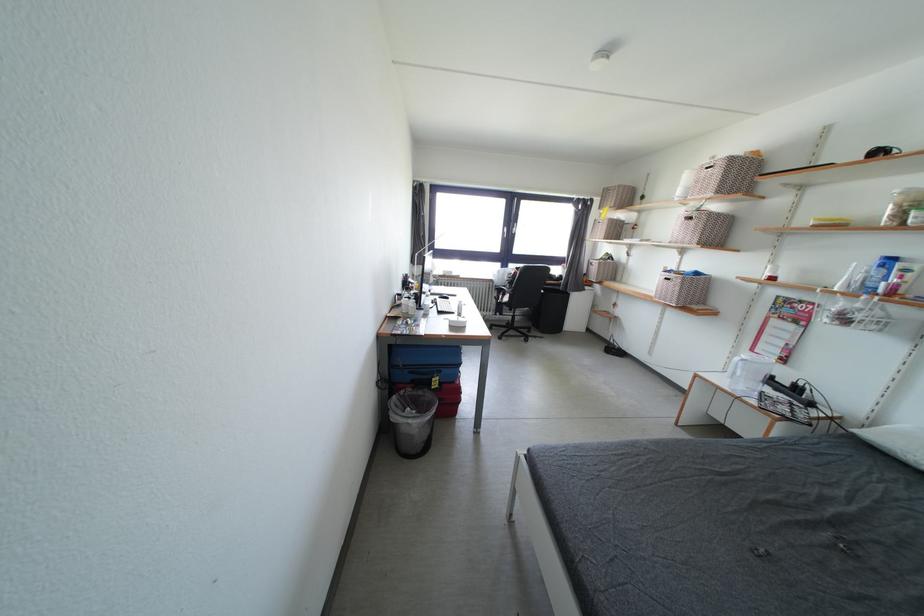
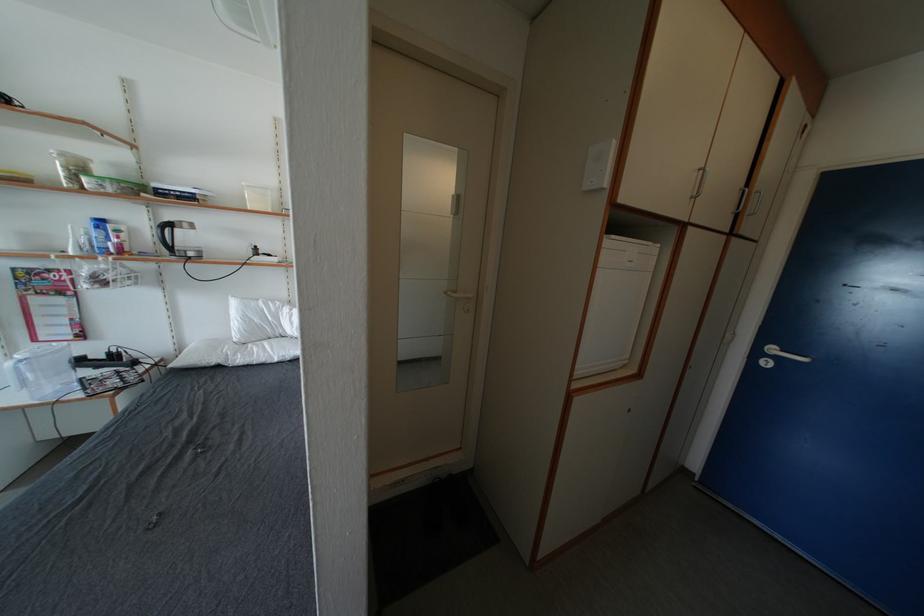
How did the camera likely rotate?

The rotation direction of the camera is right-down.